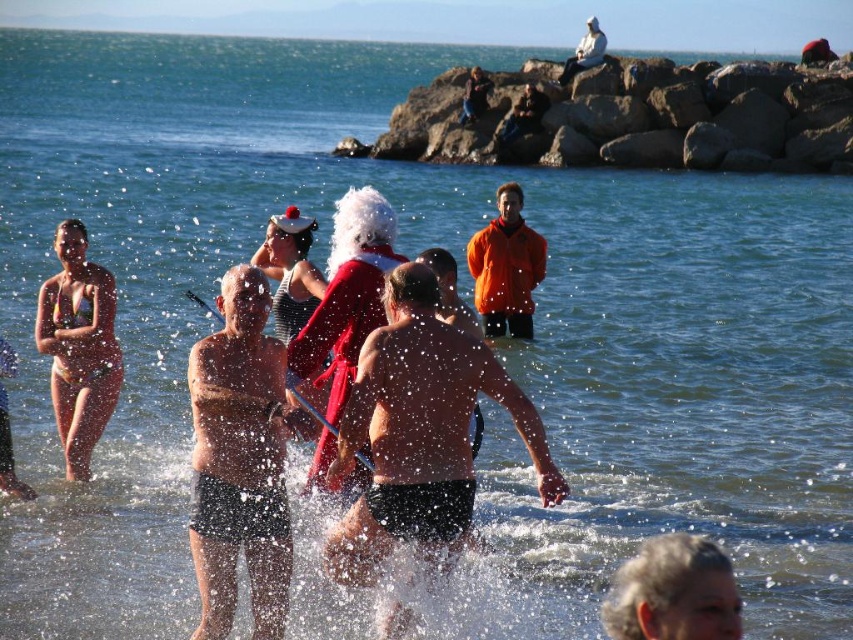
Question: Which point is closer to the camera?

Choices:
 (A) (579, 38)
 (B) (474, 374)

Answer: (B)

Question: Observing the image, what is the correct spatial positioning of smooth red fabric at center in reference to white fabric santa at upper center?

Choices:
 (A) above
 (B) below

Answer: (B)

Question: Considering the real-world distances, which object is farthest from the smooth red fabric at center?

Choices:
 (A) gray hair at lower right
 (B) black matte shorts at center
 (C) matte bikini at left
 (D) santa hat at center

Answer: (D)

Question: Is orange matte jacket at center to the left of santa hat at center from the viewer's perspective?

Choices:
 (A) yes
 (B) no

Answer: (B)

Question: Can you confirm if matte bikini at left is positioned to the left of gray hair at lower right?

Choices:
 (A) no
 (B) yes

Answer: (B)

Question: Which of the following is the farthest from the observer?

Choices:
 (A) smooth red fabric at center
 (B) santa hat at center
 (C) black matte shorts at center
 (D) white fabric santa at upper center

Answer: (D)